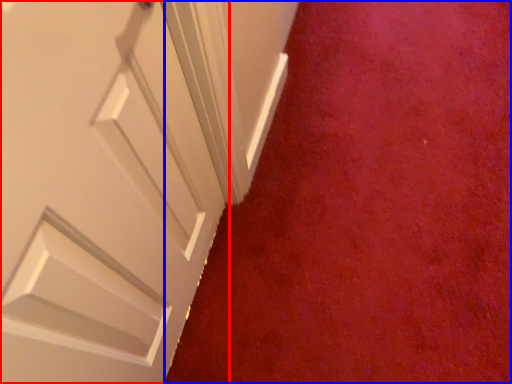
Question: Which object appears closest to the camera in this image, door (highlighted by a red box) or plain (highlighted by a blue box)?

Choices:
 (A) door
 (B) plain

Answer: (A)